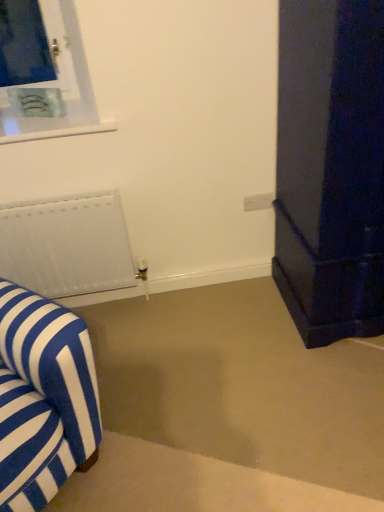
This screenshot has height=512, width=384. What do you see at coordinates (67, 245) in the screenshot? I see `white matte radiator at left` at bounding box center [67, 245].

In order to face blue and white striped fabric armchair at left, should I rotate leftwards or rightwards?

It's best to rotate left around 25.946 degrees.

At what (x,y) coordinates should I click in order to perform the action: click on white plastic electric outlet at center. Please return your answer as a coordinate pair (x, y). Looking at the image, I should click on tap(258, 202).

How much distance is there between blue and white striped fabric armchair at left and white plastic electric outlet at center?

The distance of blue and white striped fabric armchair at left from white plastic electric outlet at center is 4.23 feet.

Where is `furniture below the white plastic electric outlet at center (from a real-world perspective)`? This screenshot has height=512, width=384. furniture below the white plastic electric outlet at center (from a real-world perspective) is located at coordinates (43, 398).

How many degrees apart are the facing directions of blue and white striped fabric armchair at left and white plastic electric outlet at center?

blue and white striped fabric armchair at left and white plastic electric outlet at center are facing 43.1 degrees away from each other.

Considering the relative sizes of blue and white striped fabric armchair at left and white plastic electric outlet at center in the image provided, is blue and white striped fabric armchair at left wider than white plastic electric outlet at center?

Yes, blue and white striped fabric armchair at left is wider than white plastic electric outlet at center.

From the image's perspective, which one is positioned higher, white matte radiator at left or white plastic electric outlet at center?

white plastic electric outlet at center appears higher in the image.

Is white matte radiator at left shorter than white plastic electric outlet at center?

In fact, white matte radiator at left may be taller than white plastic electric outlet at center.

Does point (29, 282) come in front of point (252, 199)?

Yes, point (29, 282) is closer to viewer.

Is point (273, 193) behind point (82, 436)?

Yes, it is behind point (82, 436).

From the picture: From a real-world perspective, relative to blue and white striped fabric armchair at left, is white plastic electric outlet at center vertically above or below?

white plastic electric outlet at center is situated higher than blue and white striped fabric armchair at left in the real world.

From the image's perspective, which is above, white plastic electric outlet at center or blue and white striped fabric armchair at left?

white plastic electric outlet at center, from the image's perspective.

From a real-world perspective, is blue and white striped fabric armchair at left physically located above or below white matte radiator at left?

blue and white striped fabric armchair at left is situated higher than white matte radiator at left in the real world.

Between point (78, 447) and point (81, 209), which one is positioned in front?

The point (78, 447) is more forward.

Considering the sizes of blue and white striped fabric armchair at left and white matte radiator at left in the image, is blue and white striped fabric armchair at left bigger or smaller than white matte radiator at left?

blue and white striped fabric armchair at left is bigger than white matte radiator at left.

From the image's perspective, does blue and white striped fabric armchair at left appear lower than white matte radiator at left?

Yes.

From a real-world perspective, is white plastic electric outlet at center positioned under white matte radiator at left based on gravity?

No, from a real-world perspective, white plastic electric outlet at center is not under white matte radiator at left.

Which object is thinner, white plastic electric outlet at center or white matte radiator at left?

white plastic electric outlet at center.

Who is smaller, white plastic electric outlet at center or white matte radiator at left?

white plastic electric outlet at center is smaller.

Is white plastic electric outlet at center far from white matte radiator at left?

No, white plastic electric outlet at center is in close proximity to white matte radiator at left.

Which is closer to the camera, (x=51, y=271) or (x=13, y=479)?

The point (x=13, y=479) is closer.

Can blue and white striped fabric armchair at left be found inside white matte radiator at left?

No, blue and white striped fabric armchair at left is not surrounded by white matte radiator at left.

Is white matte radiator at left directly adjacent to blue and white striped fabric armchair at left?

white matte radiator at left and blue and white striped fabric armchair at left are not in contact.

Locate an element on the screen. The width and height of the screenshot is (384, 512). furniture in front of the white plastic electric outlet at center is located at coordinates (43, 398).

What are the coordinates of `radiator below the white plastic electric outlet at center (from a real-world perspective)` in the screenshot? It's located at (67, 245).

Estimate the real-world distances between objects in this image. Which object is closer to blue and white striped fabric armchair at left, white plastic electric outlet at center or white matte radiator at left?

white matte radiator at left is closer to blue and white striped fabric armchair at left.

Considering their positions, is blue and white striped fabric armchair at left positioned closer to white matte radiator at left than white plastic electric outlet at center?

blue and white striped fabric armchair at left lies closer to white matte radiator at left than the other object.

From the picture: From the image, which object appears to be nearer to white plastic electric outlet at center, white matte radiator at left or blue and white striped fabric armchair at left?

Among the two, white matte radiator at left is located nearer to white plastic electric outlet at center.

Looking at this image, estimate the real-world distances between objects in this image. Which object is closer to white matte radiator at left, white plastic electric outlet at center or blue and white striped fabric armchair at left?

Among the two, blue and white striped fabric armchair at left is located nearer to white matte radiator at left.

Looking at the image, which one is located further to blue and white striped fabric armchair at left, white matte radiator at left or white plastic electric outlet at center?

white plastic electric outlet at center.

From the image, which object appears to be nearer to white plastic electric outlet at center, blue and white striped fabric armchair at left or white matte radiator at left?

Based on the image, white matte radiator at left appears to be nearer to white plastic electric outlet at center.

The height and width of the screenshot is (512, 384). What are the coordinates of `radiator between blue and white striped fabric armchair at left and white plastic electric outlet at center from front to back` in the screenshot? It's located at (67, 245).